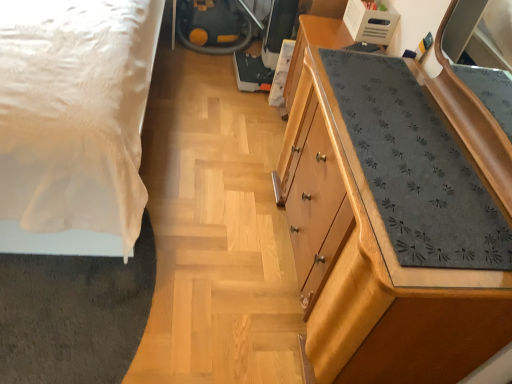
The width and height of the screenshot is (512, 384). Find the location of `wooden dresser at right`. wooden dresser at right is located at coordinates (387, 274).

This screenshot has height=384, width=512. What do you see at coordinates (387, 274) in the screenshot? I see `wooden dresser at right` at bounding box center [387, 274].

At what (x,y) coordinates should I click in order to perform the action: click on white satin bed at left. Please return your answer as a coordinate pair (x, y). The height and width of the screenshot is (384, 512). Looking at the image, I should click on (74, 122).

What do you see at coordinates (74, 122) in the screenshot?
I see `white satin bed at left` at bounding box center [74, 122].

Consider the image. In order to face white satin bed at left, should I rotate leftwards or rightwards?

Rotate left and turn 27.309 degrees.

I want to click on wooden dresser at right, so click(x=387, y=274).

Is white satin bed at left at the right side of wooden dresser at right?

No.

Which object is further away from the camera, white satin bed at left or wooden dresser at right?

wooden dresser at right is further away from the camera.

Is point (91, 148) positioned after point (295, 76)?

No, it is not.

From the image's perspective, which is above, white satin bed at left or wooden dresser at right?

white satin bed at left appears higher in the image.

From a real-world perspective, is white satin bed at left positioned above or below wooden dresser at right?

white satin bed at left is above wooden dresser at right.

In terms of width, does white satin bed at left look wider or thinner when compared to wooden dresser at right?

Clearly, white satin bed at left has more width compared to wooden dresser at right.

Is white satin bed at left shorter than wooden dresser at right?

No.

In terms of size, does white satin bed at left appear bigger or smaller than wooden dresser at right?

Clearly, white satin bed at left is larger in size than wooden dresser at right.

Do you think white satin bed at left is within wooden dresser at right, or outside of it?

white satin bed at left is not enclosed by wooden dresser at right.

Is white satin bed at left beside wooden dresser at right?

No, white satin bed at left is not next to wooden dresser at right.

Is white satin bed at left facing towards wooden dresser at right?

No, white satin bed at left does not turn towards wooden dresser at right.

Identify the location of chest of drawers that appears on the right of white satin bed at left. (387, 274).

Based on their positions, is wooden dresser at right located to the left or right of white satin bed at left?

wooden dresser at right is to the right of white satin bed at left.

Between wooden dresser at right and white satin bed at left, which one is positioned in front?

white satin bed at left.

Is point (414, 322) behind point (28, 174)?

No, it is not.

From the image's perspective, which one is positioned higher, wooden dresser at right or white satin bed at left?

white satin bed at left, from the image's perspective.

From a real-world perspective, which is physically above, wooden dresser at right or white satin bed at left?

white satin bed at left, from a real-world perspective.

Considering the relative sizes of wooden dresser at right and white satin bed at left in the image provided, is wooden dresser at right wider than white satin bed at left?

No.

Between wooden dresser at right and white satin bed at left, which one has more height?

Standing taller between the two is white satin bed at left.

Considering the relative sizes of wooden dresser at right and white satin bed at left in the image provided, is wooden dresser at right smaller than white satin bed at left?

Yes.

Is wooden dresser at right completely or partially outside of white satin bed at left?

Yes, wooden dresser at right is located beyond the bounds of white satin bed at left.

Is wooden dresser at right directly adjacent to white satin bed at left?

wooden dresser at right is not next to white satin bed at left, and they're not touching.

Looking at this image, is wooden dresser at right looking in the opposite direction of white satin bed at left?

No, wooden dresser at right is not facing the opposite direction of white satin bed at left.

How different are the orientations of wooden dresser at right and white satin bed at left in degrees?

wooden dresser at right and white satin bed at left are facing 91.2 degrees away from each other.

Identify the location of bed located in front of the wooden dresser at right. This screenshot has width=512, height=384. pyautogui.click(x=74, y=122).

The height and width of the screenshot is (384, 512). In order to click on the chest of drawers below the white satin bed at left (from the image's perspective) in this screenshot , I will do `click(387, 274)`.

Identify the location of bed lying above the wooden dresser at right (from the image's perspective). The width and height of the screenshot is (512, 384). (74, 122).